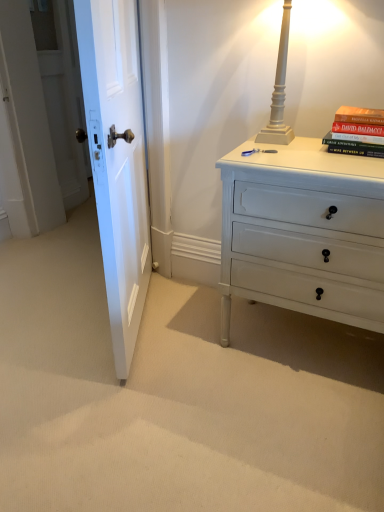
This screenshot has width=384, height=512. Describe the element at coordinates (279, 89) in the screenshot. I see `white painted wood table lamp at upper right` at that location.

Locate an element on the screen. The height and width of the screenshot is (512, 384). white painted wood table lamp at upper right is located at coordinates (279, 89).

You are a GUI agent. You are given a task and a screenshot of the screen. Output one action in this format:
    pyautogui.click(x=<x>, y=<y>)
    Task: Click on the white painted wood table lamp at upper right
    
    Given the screenshot: What is the action you would take?
    pyautogui.click(x=279, y=89)

Is hardcover book at upper right oriented away from white painted wood chest of drawers at right?

No.

Can you confirm if hardcover book at upper right is positioned to the right of white painted wood chest of drawers at right?

Correct, you'll find hardcover book at upper right to the right of white painted wood chest of drawers at right.

Considering the sizes of objects hardcover book at upper right and white painted wood chest of drawers at right in the image provided, who is wider, hardcover book at upper right or white painted wood chest of drawers at right?

white painted wood chest of drawers at right.

From a real-world perspective, is hardcover book at upper right above or below white painted wood chest of drawers at right?

Clearly, from a real-world perspective, hardcover book at upper right is above white painted wood chest of drawers at right.

Where is `table lamp lying above the white wooden door at left (from the image's perspective)`? table lamp lying above the white wooden door at left (from the image's perspective) is located at coordinates (279, 89).

From the image's perspective, which one is positioned lower, white wooden door at left or white painted wood table lamp at upper right?

white wooden door at left is shown below in the image.

Is white wooden door at left positioned with its back to white painted wood table lamp at upper right?

Yes.

Based on the photo, which object is wider, white wooden door at left or white painted wood table lamp at upper right?

white painted wood table lamp at upper right is wider.

In the scene shown: Considering the sizes of white wooden door at left and white painted wood chest of drawers at right in the image, is white wooden door at left bigger or smaller than white painted wood chest of drawers at right?

In the image, white wooden door at left appears to be smaller than white painted wood chest of drawers at right.

Considering the relative sizes of white wooden door at left and white painted wood chest of drawers at right in the image provided, is white wooden door at left thinner than white painted wood chest of drawers at right?

Yes, white wooden door at left is thinner than white painted wood chest of drawers at right.

Locate an element on the screen. The width and height of the screenshot is (384, 512). door in front of the white painted wood chest of drawers at right is located at coordinates (117, 161).

Does white wooden door at left have a greater height compared to white painted wood chest of drawers at right?

Correct, white wooden door at left is much taller as white painted wood chest of drawers at right.

Is white painted wood table lamp at upper right to the left of white wooden door at left from the viewer's perspective?

In fact, white painted wood table lamp at upper right is to the right of white wooden door at left.

At what (x,y) coordinates should I click in order to perform the action: click on table lamp on the right of white wooden door at left. Please return your answer as a coordinate pair (x, y). The height and width of the screenshot is (512, 384). Looking at the image, I should click on (279, 89).

From the image's perspective, is white painted wood table lamp at upper right on top of white wooden door at left?

Yes, from the image's perspective, white painted wood table lamp at upper right is on top of white wooden door at left.

From a real-world perspective, is white painted wood table lamp at upper right below white wooden door at left?

No, from a real-world perspective, white painted wood table lamp at upper right is not below white wooden door at left.

Where is `door on the left side of white painted wood chest of drawers at right`? door on the left side of white painted wood chest of drawers at right is located at coordinates (117, 161).

From the image's perspective, is white painted wood chest of drawers at right located above white wooden door at left?

No, from the image's perspective, white painted wood chest of drawers at right is not on top of white wooden door at left.

Is point (341, 184) positioned after point (141, 208)?

No.

Is white painted wood chest of drawers at right behind white wooden door at left?

Yes, white painted wood chest of drawers at right is further from the viewer.

Is hardcover book at upper right at the back of white painted wood table lamp at upper right?

No, hardcover book at upper right is not at the back of white painted wood table lamp at upper right.

Consider the image. In the image, is white painted wood table lamp at upper right positioned in front of or behind hardcover book at upper right?

Visually, white painted wood table lamp at upper right is located in front of hardcover book at upper right.

Considering the relative sizes of white painted wood table lamp at upper right and hardcover book at upper right in the image provided, is white painted wood table lamp at upper right smaller than hardcover book at upper right?

Incorrect, white painted wood table lamp at upper right is not smaller in size than hardcover book at upper right.

From the image's perspective, which one is positioned higher, white painted wood table lamp at upper right or hardcover book at upper right?

white painted wood table lamp at upper right appears higher in the image.

In the scene shown: From the image's perspective, is hardcover book at upper right on top of white painted wood table lamp at upper right?

Actually, hardcover book at upper right appears below white painted wood table lamp at upper right in the image.

Does hardcover book at upper right touch white painted wood table lamp at upper right?

No, hardcover book at upper right is not touching white painted wood table lamp at upper right.

Considering the sizes of objects hardcover book at upper right and white painted wood table lamp at upper right in the image provided, who is thinner, hardcover book at upper right or white painted wood table lamp at upper right?

hardcover book at upper right.

Which is more to the left, hardcover book at upper right or white painted wood table lamp at upper right?

white painted wood table lamp at upper right is more to the left.

I want to click on paperback book above the white painted wood chest of drawers at right (from the image's perspective), so click(x=357, y=132).

Image resolution: width=384 pixels, height=512 pixels. I want to click on door that appears on the left of white painted wood table lamp at upper right, so pyautogui.click(x=117, y=161).

Looking at the image, which one is located further to white painted wood table lamp at upper right, white painted wood chest of drawers at right or white wooden door at left?

white wooden door at left is positioned further to the anchor white painted wood table lamp at upper right.

Considering their positions, is hardcover book at upper right positioned closer to white wooden door at left than white painted wood table lamp at upper right?

Among the two, white painted wood table lamp at upper right is located nearer to white wooden door at left.

In the scene shown: When comparing their distances from hardcover book at upper right, does white wooden door at left or white painted wood table lamp at upper right seem closer?

white painted wood table lamp at upper right lies closer to hardcover book at upper right than the other object.

From the picture: Which object lies further to the anchor point hardcover book at upper right, white wooden door at left or white painted wood chest of drawers at right?

Among the two, white wooden door at left is located further to hardcover book at upper right.

Which object lies nearer to the anchor point white painted wood table lamp at upper right, hardcover book at upper right or white painted wood chest of drawers at right?

hardcover book at upper right lies closer to white painted wood table lamp at upper right than the other object.

Looking at the image, which one is located closer to white painted wood table lamp at upper right, hardcover book at upper right or white wooden door at left?

hardcover book at upper right lies closer to white painted wood table lamp at upper right than the other object.

Looking at the image, which one is located closer to white wooden door at left, white painted wood table lamp at upper right or hardcover book at upper right?

The object closer to white wooden door at left is white painted wood table lamp at upper right.

Estimate the real-world distances between objects in this image. Which object is closer to hardcover book at upper right, white painted wood table lamp at upper right or white wooden door at left?

Among the two, white painted wood table lamp at upper right is located nearer to hardcover book at upper right.

Image resolution: width=384 pixels, height=512 pixels. I want to click on chest of drawers between white wooden door at left and hardcover book at upper right from left to right, so click(x=304, y=233).

The width and height of the screenshot is (384, 512). Identify the location of paperback book between white painted wood table lamp at upper right and white painted wood chest of drawers at right from top to bottom. (357, 132).

Where is `table lamp between white wooden door at left and white painted wood chest of drawers at right in the horizontal direction`? The image size is (384, 512). table lamp between white wooden door at left and white painted wood chest of drawers at right in the horizontal direction is located at coordinates (279, 89).

Locate an element on the screen. This screenshot has height=512, width=384. table lamp situated between white wooden door at left and hardcover book at upper right from left to right is located at coordinates point(279,89).